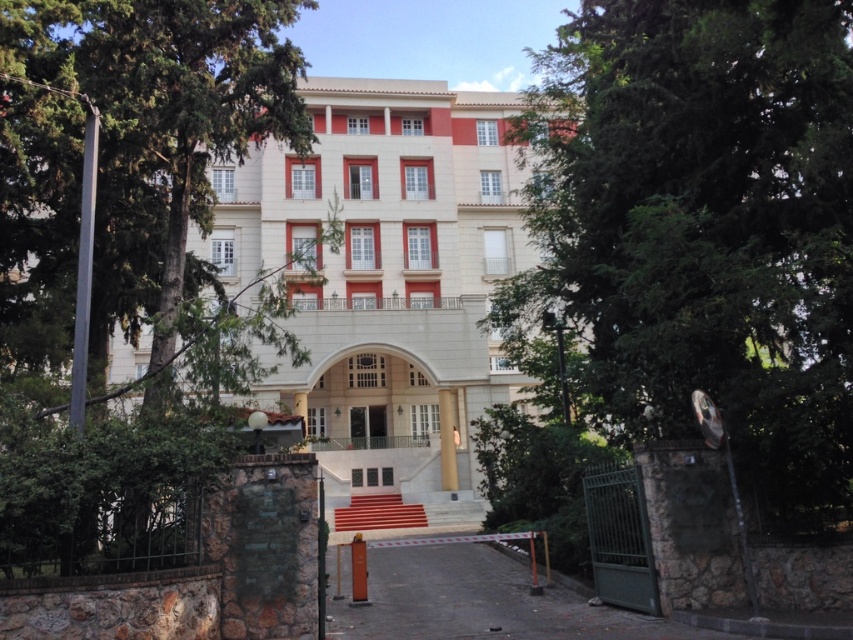
Question: Which point appears farthest from the camera in this image?

Choices:
 (A) (763, 413)
 (B) (363, 385)
 (C) (47, 236)

Answer: (B)

Question: Is green leafy tree at center above green leafy tree at left?

Choices:
 (A) no
 (B) yes

Answer: (A)

Question: Considering the real-world distances, which object is closest to the beige stone building at center?

Choices:
 (A) green leafy tree at center
 (B) green leafy tree at left

Answer: (B)

Question: Is green leafy tree at left below beige stone building at center?

Choices:
 (A) no
 (B) yes

Answer: (B)

Question: Based on their relative distances, which object is nearer to the beige stone building at center?

Choices:
 (A) green leafy tree at center
 (B) green leafy tree at left

Answer: (B)

Question: Is green leafy tree at center bigger than beige stone building at center?

Choices:
 (A) yes
 (B) no

Answer: (B)